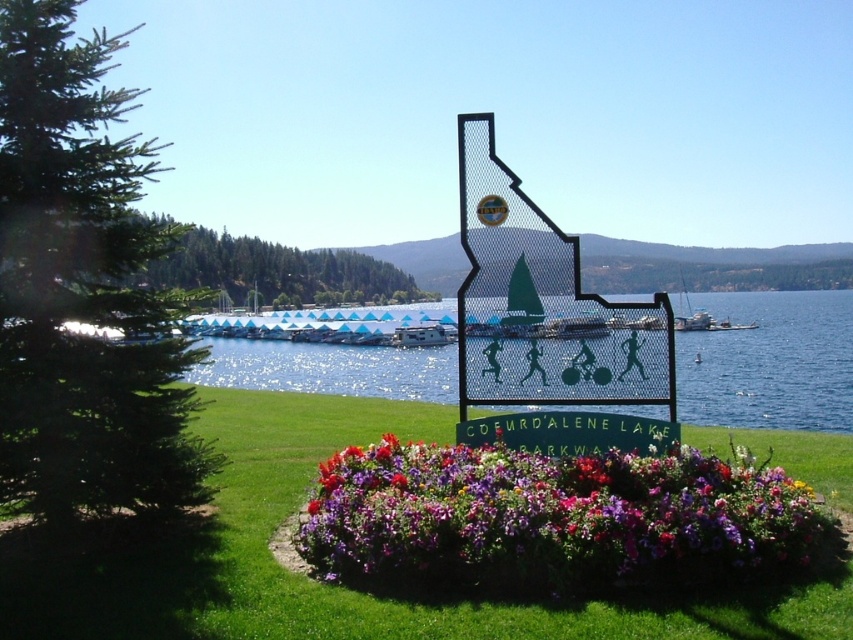
Question: Is vibrant multicolored petals at center wider than metallic silver boat at center?

Choices:
 (A) no
 (B) yes

Answer: (B)

Question: Can you confirm if vibrant multicolored petals at center is wider than metallic silver boat at center?

Choices:
 (A) no
 (B) yes

Answer: (B)

Question: Which object is farther from the camera taking this photo?

Choices:
 (A) vibrant multicolored petals at center
 (B) metallic silver boat at center

Answer: (B)

Question: Can you confirm if vibrant multicolored petals at center is positioned above metallic silver boat at center?

Choices:
 (A) yes
 (B) no

Answer: (B)

Question: Which of the following is the closest to the observer?

Choices:
 (A) (424, 324)
 (B) (345, 461)

Answer: (B)